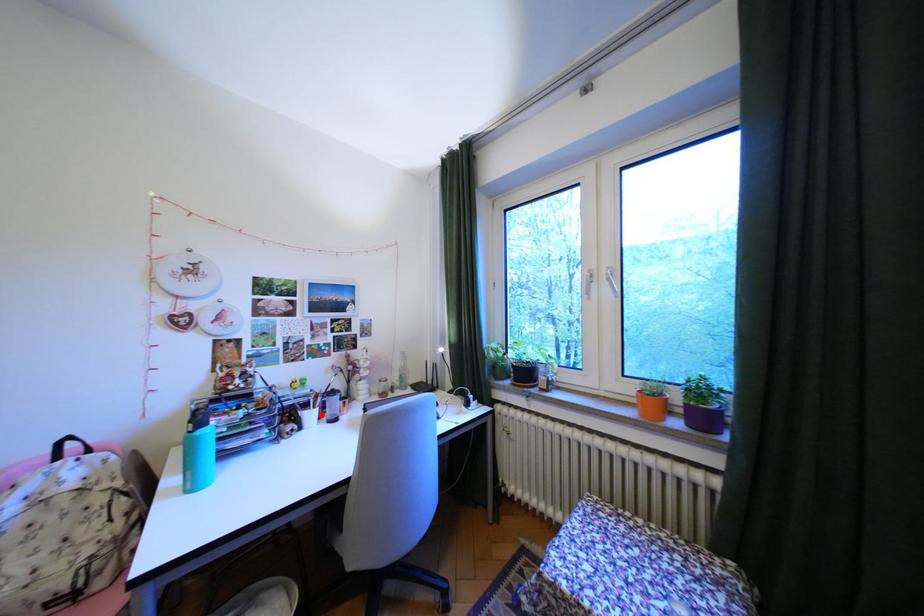
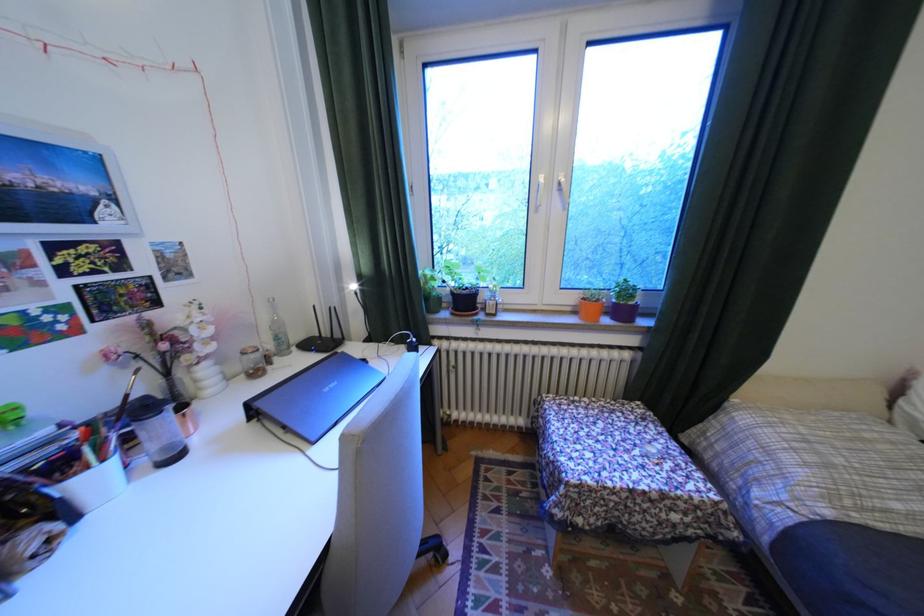
Where in the second image is the point corresponding to the highlighted location from the first image?

(106, 479)